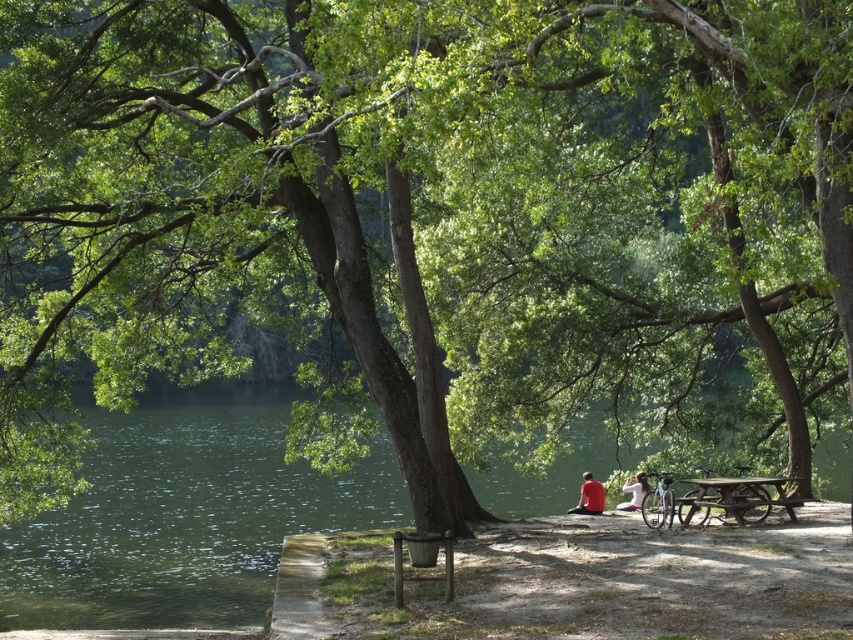
You are an observer standing at the lakeside and notice a red matte shirt at center and a white fabric shirt at lower center. Which shirt is closer to you?

The red matte shirt at center is closer to you because it is in front of the white fabric shirt at lower center.

You are standing at the point labeled as point (735, 497) in the image. Looking around, you see a wooden picnic table at lower right. What object are you standing on?

You are standing on the wooden picnic table at lower right because the coordinates point (735, 497) correspond to that object.

You are planning to set up a picnic and need to place a basket on the ground near the wooden picnic table at lower right and the matte red shirt at center. Which object should you place the basket closer to if you want it to be as close as possible to both objects?

The basket should be placed closer to the matte red shirt at center because the wooden picnic table at lower right is on the right side of the matte red shirt at center, making the shirt the central point between them.